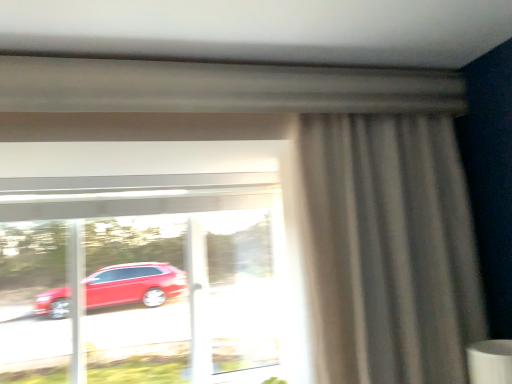
Question: From a real-world perspective, relative to transparent glass window at center, is matte gray curtain at right vertically above or below?

Choices:
 (A) below
 (B) above

Answer: (B)

Question: In the image, is matte gray curtain at right positioned in front of or behind transparent glass window at center?

Choices:
 (A) behind
 (B) front

Answer: (B)

Question: Considering the positions of matte gray curtain at right and transparent glass window at center in the image, is matte gray curtain at right bigger or smaller than transparent glass window at center?

Choices:
 (A) small
 (B) big

Answer: (A)

Question: Considering the positions of transparent glass window at center and matte gray curtain at right in the image, is transparent glass window at center wider or thinner than matte gray curtain at right?

Choices:
 (A) thin
 (B) wide

Answer: (A)

Question: From a real-world perspective, is transparent glass window at center above or below matte gray curtain at right?

Choices:
 (A) above
 (B) below

Answer: (B)

Question: Is transparent glass window at center in front of or behind matte gray curtain at right in the image?

Choices:
 (A) behind
 (B) front

Answer: (A)

Question: Visually, is transparent glass window at center positioned to the left or to the right of matte gray curtain at right?

Choices:
 (A) left
 (B) right

Answer: (A)